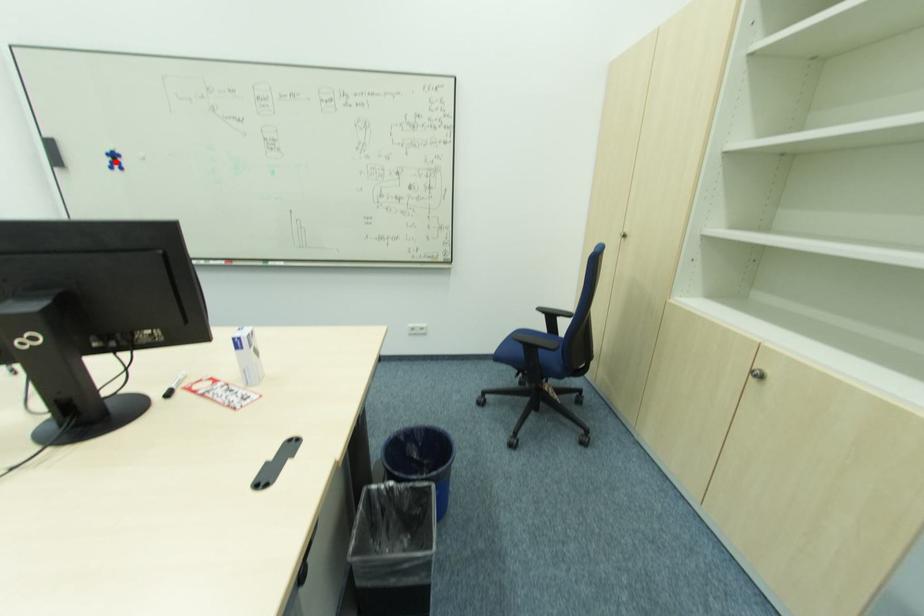
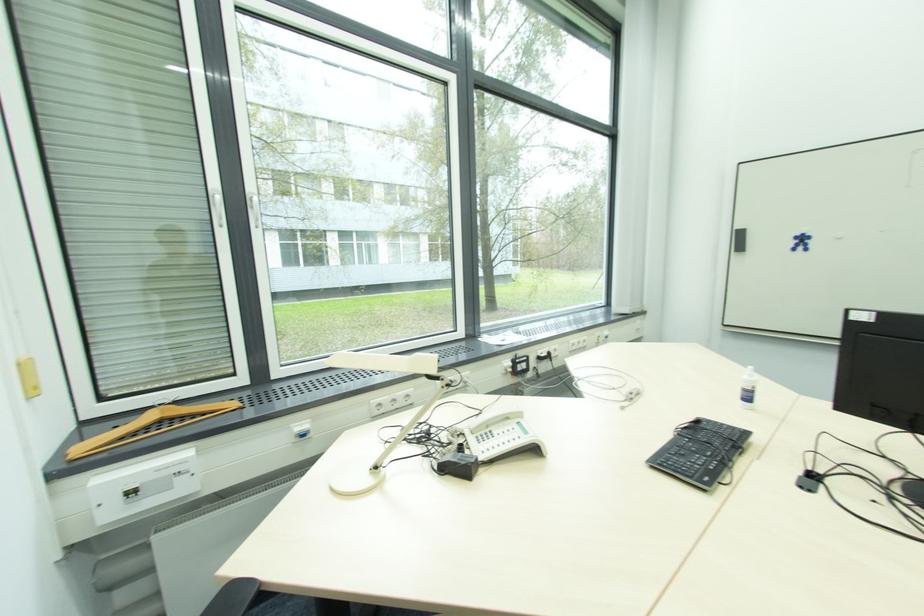
The point at the highlighted location is marked in the first image. Where is the corresponding point in the second image?

(801, 244)